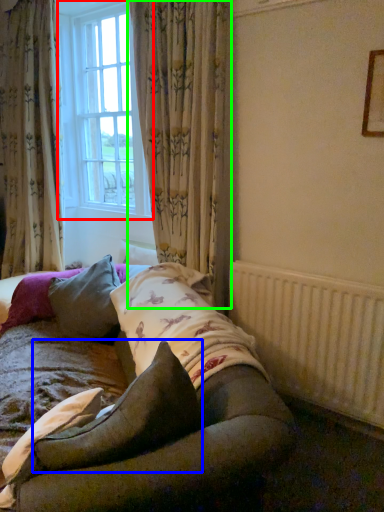
Question: Which is farther away from window (highlighted by a red box)? pillow (highlighted by a blue box) or curtain (highlighted by a green box)?

Choices:
 (A) pillow
 (B) curtain

Answer: (A)